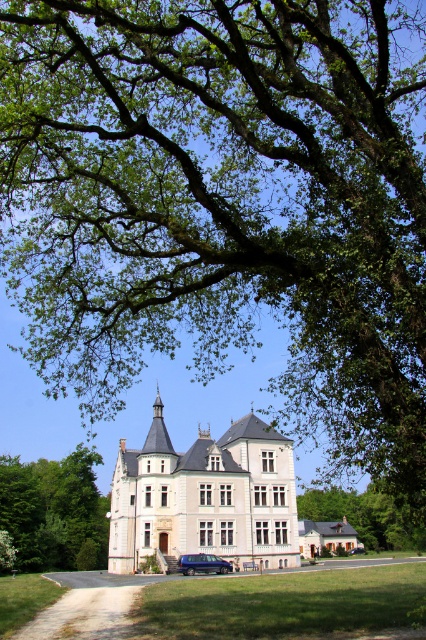
You are a visitor arriving at the grand building and need to park your car. The gray gravel driveway at center and the orange brick house at center are both visible from your current position. Which one should you head towards to find a suitable parking spot?

The gray gravel driveway at center is above the orange brick house at center, so you should head towards the gray gravel driveway at center as it is positioned higher and likely leads to the entrance for parking.

You are a delivery driver approaching the manor house. You see the gray gravel driveway at center and the dark blue metallic van at lower center. Where should you park your vehicle to avoid blocking the driveway?

You should park the dark blue metallic van at lower center above the gray gravel driveway at center to avoid blocking the driveway since the driveway is located below the van.

From the picture: You are a visitor arriving at the grand building and need to park your car. The gray gravel driveway at center and the orange brick house at center are in your view. Which direction should you turn to reach the driveway from the house?

You should turn to the left from the orange brick house at center to reach the gray gravel driveway at center since the gray gravel driveway at center is to the left of orange brick house at center.